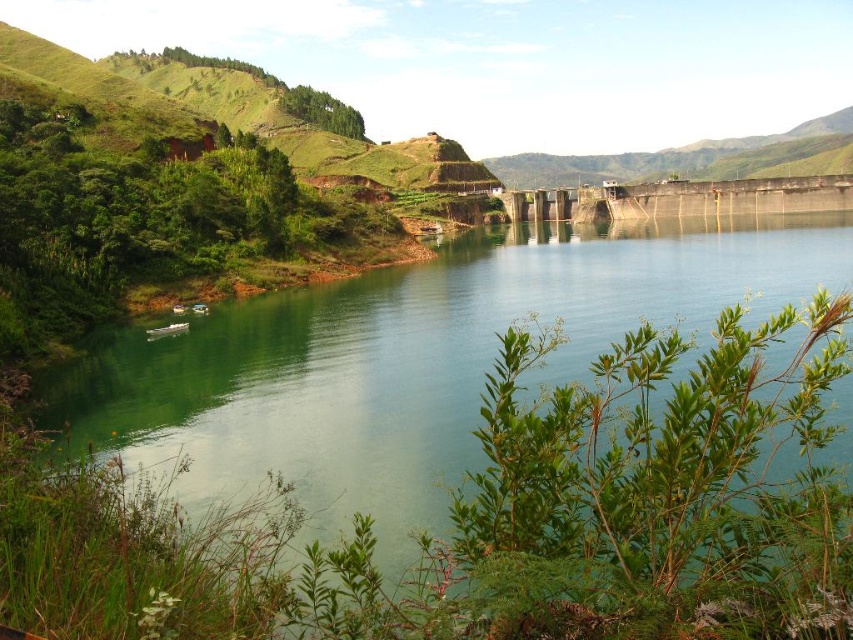
Question: Which point is farther to the camera?

Choices:
 (A) (42, 516)
 (B) (786, 524)

Answer: (A)

Question: Can you confirm if green smooth water at center is positioned below green leafy plant at lower right?

Choices:
 (A) no
 (B) yes

Answer: (A)

Question: Can you confirm if green smooth water at center is thinner than green leafy plant at lower right?

Choices:
 (A) yes
 (B) no

Answer: (B)

Question: Does green smooth water at center have a smaller size compared to green leafy plant at lower right?

Choices:
 (A) no
 (B) yes

Answer: (A)